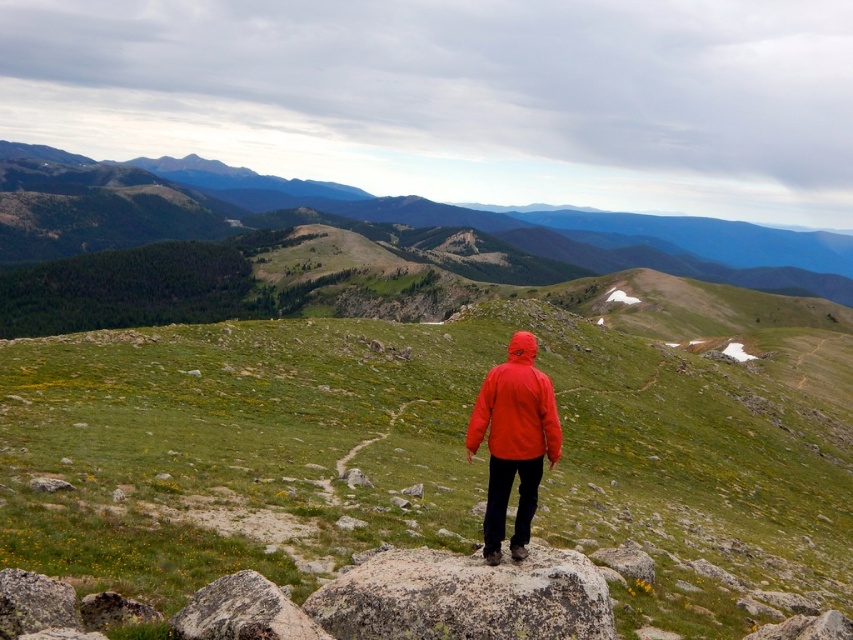
Who is taller, green grassy hill at upper center or matte orange jacket at center?

With more height is green grassy hill at upper center.

Can you confirm if green grassy hill at upper center is positioned above matte orange jacket at center?

Yes, green grassy hill at upper center is above matte orange jacket at center.

Is point (73, 324) positioned before point (515, 544)?

That is False.

Where is `green grassy hill at upper center`? The width and height of the screenshot is (853, 640). green grassy hill at upper center is located at coordinates (321, 236).

Between green grassy hillside at center and matte orange jacket at center, which one has more height?

green grassy hillside at center is taller.

Is green grassy hillside at center further to the viewer compared to matte orange jacket at center?

That is False.

This screenshot has width=853, height=640. What do you see at coordinates (426, 456) in the screenshot?
I see `green grassy hillside at center` at bounding box center [426, 456].

Where is `green grassy hillside at center`? green grassy hillside at center is located at coordinates (426, 456).

From the picture: Does green grassy hillside at center appear on the left side of green grassy hill at upper center?

No, green grassy hillside at center is not to the left of green grassy hill at upper center.

Between point (610, 355) and point (633, 234), which one is positioned behind?

The point (633, 234) is behind.

You are a GUI agent. You are given a task and a screenshot of the screen. Output one action in this format:
    pyautogui.click(x=<x>, y=<y>)
    Task: Click on the green grassy hillside at center
    This screenshot has width=853, height=640.
    Given the screenshot: What is the action you would take?
    pyautogui.click(x=426, y=456)